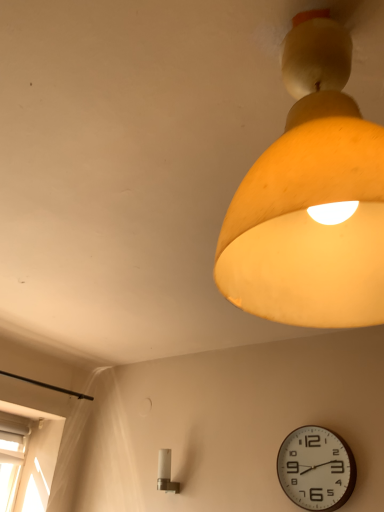
Question: Based on their positions, is white plastic clock at lower right located to the left or right of white glossy light fixture at lower center, which appears as the 1th lamp when ordered from the bottom?

Choices:
 (A) left
 (B) right

Answer: (B)

Question: Considering the positions of white plastic clock at lower right and white glossy light fixture at lower center, the second lamp in the right-to-left sequence, in the image, is white plastic clock at lower right wider or thinner than white glossy light fixture at lower center, the second lamp in the right-to-left sequence,?

Choices:
 (A) thin
 (B) wide

Answer: (A)

Question: Which object is positioned farthest from the white glossy light fixture at lower center, which appears as the 1th lamp when ordered from the bottom?

Choices:
 (A) matte yellow lampshade at upper right, the first lamp from the top
 (B) white plastic clock at lower right

Answer: (A)

Question: Which object is positioned farthest from the white plastic clock at lower right?

Choices:
 (A) white glossy light fixture at lower center, which appears as the second lamp when viewed from the top
 (B) matte yellow lampshade at upper right, the 1th lamp positioned from the front

Answer: (B)